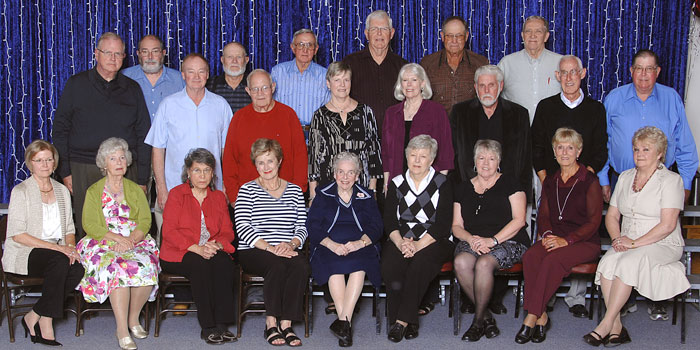
The width and height of the screenshot is (700, 350). Find the location of `strands of white led lighting`. strands of white led lighting is located at coordinates click(70, 29), click(470, 11), click(620, 22).